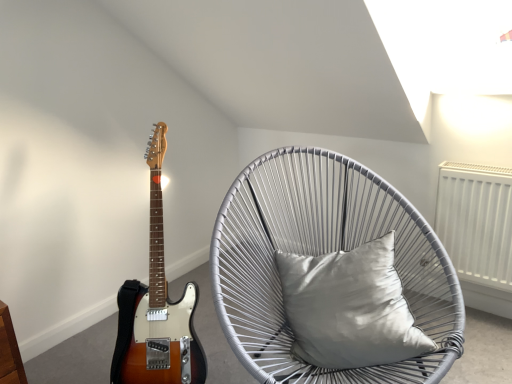
I want to click on satin silver pillow at center, so click(349, 308).

Describe the element at coordinates (349, 308) in the screenshot. This screenshot has width=512, height=384. I see `satin silver pillow at center` at that location.

Identify the location of satin wood guitar at left. This screenshot has width=512, height=384. (157, 307).

From the picture: Is satin wood guitar at left facing away from silver woven chair with cushion at center?

satin wood guitar at left is not turned away from silver woven chair with cushion at center.

Can you confirm if satin wood guitar at left is taller than silver woven chair with cushion at center?

Correct, satin wood guitar at left is much taller as silver woven chair with cushion at center.

I want to click on chair in front of the satin wood guitar at left, so click(321, 254).

Is point (177, 307) farther from camera compared to point (356, 380)?

Yes, it is behind point (356, 380).

Is satin silver pillow at center at the left side of silver woven chair with cushion at center?

Incorrect, satin silver pillow at center is not on the left side of silver woven chair with cushion at center.

Considering the relative sizes of satin silver pillow at center and silver woven chair with cushion at center in the image provided, is satin silver pillow at center bigger than silver woven chair with cushion at center?

Actually, satin silver pillow at center might be smaller than silver woven chair with cushion at center.

Are satin silver pillow at center and silver woven chair with cushion at center far apart?

No, satin silver pillow at center is not far from silver woven chair with cushion at center.

From a real-world perspective, is satin silver pillow at center on silver woven chair with cushion at center?

Yes.

From a real-world perspective, is silver woven chair with cushion at center on top of satin wood guitar at left?

No, from a real-world perspective, silver woven chair with cushion at center is not over satin wood guitar at left

From the image's perspective, which is below, silver woven chair with cushion at center or satin wood guitar at left?

silver woven chair with cushion at center is shown below in the image.

In the image, is silver woven chair with cushion at center positioned in front of or behind satin wood guitar at left?

silver woven chair with cushion at center is in front of satin wood guitar at left.

How many degrees apart are the facing directions of satin wood guitar at left and satin silver pillow at center?

There is a 2.47-degree angle between the facing directions of satin wood guitar at left and satin silver pillow at center.

Between satin wood guitar at left and satin silver pillow at center, which one has more height?

satin wood guitar at left is taller.

Does satin wood guitar at left have a greater width compared to satin silver pillow at center?

Yes.

Is satin silver pillow at center a part of satin wood guitar at left?

No, satin silver pillow at center is located outside of satin wood guitar at left.

From a real-world perspective, is satin silver pillow at center physically above satin wood guitar at left?

No, from a real-world perspective, satin silver pillow at center is not on top of satin wood guitar at left.

Considering the sizes of satin silver pillow at center and satin wood guitar at left in the image, is satin silver pillow at center wider or thinner than satin wood guitar at left?

In the image, satin silver pillow at center appears to be more narrow than satin wood guitar at left.

Could you tell me if satin silver pillow at center is facing satin wood guitar at left?

No, satin silver pillow at center is not turned towards satin wood guitar at left.

Is point (432, 310) closer to viewer compared to point (344, 273)?

That is True.

Between silver woven chair with cushion at center and satin silver pillow at center, which one has larger size?

With larger size is silver woven chair with cushion at center.

In the scene shown: From their relative heights in the image, would you say silver woven chair with cushion at center is taller or shorter than satin silver pillow at center?

In the image, silver woven chair with cushion at center appears to be taller than satin silver pillow at center.

At what (x,y) coordinates should I click in order to perform the action: click on guitar that appears above the silver woven chair with cushion at center (from a real-world perspective). Please return your answer as a coordinate pair (x, y). This screenshot has height=384, width=512. Looking at the image, I should click on (157, 307).

Locate an element on the screen. The width and height of the screenshot is (512, 384). chair in front of the satin silver pillow at center is located at coordinates (x=321, y=254).

Looking at the image, which one is located further to silver woven chair with cushion at center, satin wood guitar at left or satin silver pillow at center?

satin wood guitar at left.

Which object lies further to the anchor point satin silver pillow at center, satin wood guitar at left or silver woven chair with cushion at center?

The object further to satin silver pillow at center is satin wood guitar at left.

From the image, which object appears to be farther from satin silver pillow at center, silver woven chair with cushion at center or satin wood guitar at left?

The object further to satin silver pillow at center is satin wood guitar at left.

From the image, which object appears to be farther from satin wood guitar at left, silver woven chair with cushion at center or satin silver pillow at center?

satin silver pillow at center is further to satin wood guitar at left.

Which object lies further to the anchor point satin wood guitar at left, satin silver pillow at center or silver woven chair with cushion at center?

satin silver pillow at center is positioned further to the anchor satin wood guitar at left.

Estimate the real-world distances between objects in this image. Which object is closer to silver woven chair with cushion at center, satin silver pillow at center or satin wood guitar at left?

Based on the image, satin silver pillow at center appears to be nearer to silver woven chair with cushion at center.

Locate an element on the screen. The width and height of the screenshot is (512, 384). chair situated between satin wood guitar at left and satin silver pillow at center from left to right is located at coordinates [321, 254].